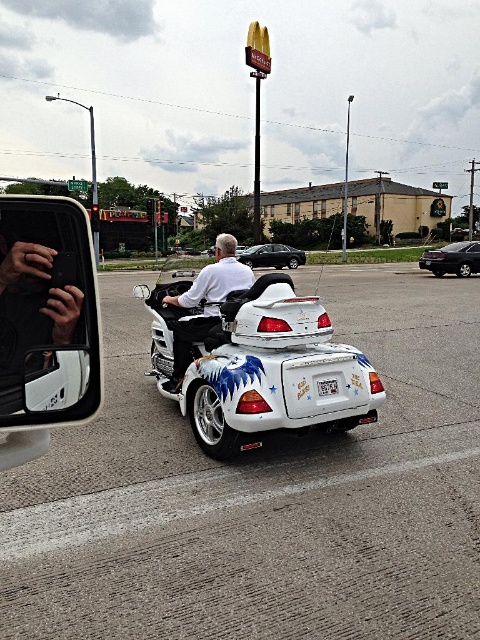
Consider the image. Who is lower down, white glossy trike at center or shiny black sedan at center?

Positioned lower is white glossy trike at center.

Which is behind, point (289, 410) or point (266, 262)?

Point (266, 262)

What do you see at coordinates (259, 364) in the screenshot? The height and width of the screenshot is (640, 480). I see `white glossy trike at center` at bounding box center [259, 364].

I want to click on white glossy trike at center, so click(259, 364).

Between white glossy trike at center and shiny black sedan at right, which one appears on the right side from the viewer's perspective?

shiny black sedan at right

Is white glossy trike at center to the left of shiny black sedan at right from the viewer's perspective?

Indeed, white glossy trike at center is positioned on the left side of shiny black sedan at right.

This screenshot has height=640, width=480. Describe the element at coordinates (259, 364) in the screenshot. I see `white glossy trike at center` at that location.

At what (x,y) coordinates should I click in order to perform the action: click on white glossy trike at center. Please return your answer as a coordinate pair (x, y). Looking at the image, I should click on (259, 364).

Does white glossy trike at center have a lesser height compared to white glossy motorcycle at center?

No.

Who is more distant from viewer, (x=272, y=317) or (x=202, y=317)?

The point (x=202, y=317) is behind.

Image resolution: width=480 pixels, height=640 pixels. I want to click on white glossy trike at center, so click(259, 364).